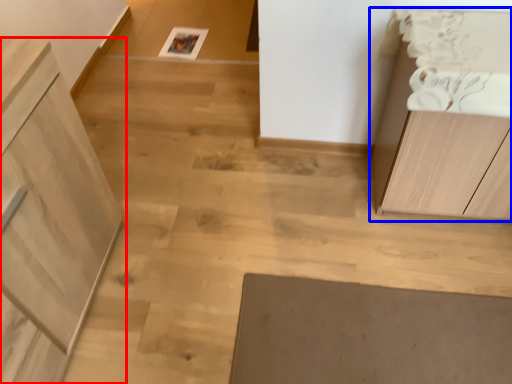
Question: Which object is further to the camera taking this photo, cabinetry (highlighted by a red box) or cabinetry (highlighted by a blue box)?

Choices:
 (A) cabinetry
 (B) cabinetry

Answer: (B)